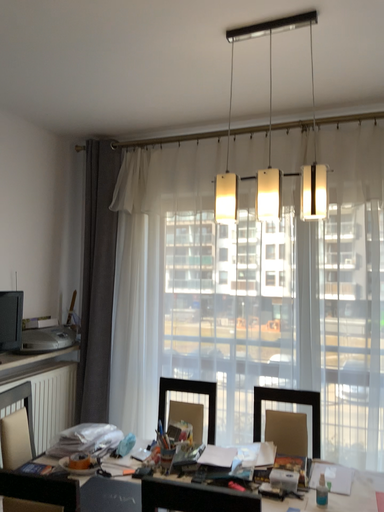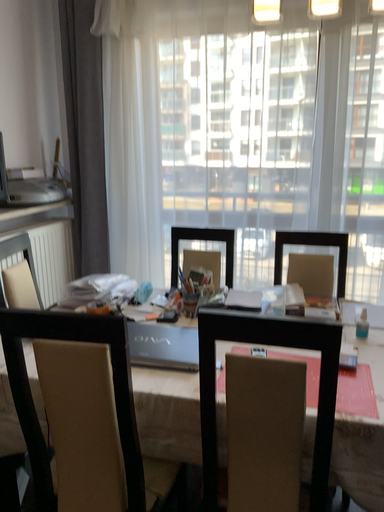
Question: How did the camera likely rotate when shooting the video?

Choices:
 (A) rotated downward
 (B) rotated upward

Answer: (A)